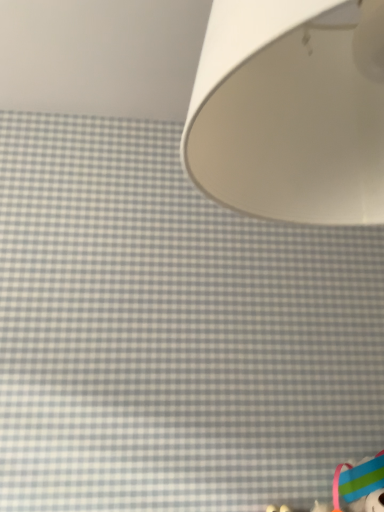
Locate an element on the screen. white matte lampshade at upper right is located at coordinates (291, 110).

What do you see at coordinates (291, 110) in the screenshot? I see `white matte lampshade at upper right` at bounding box center [291, 110].

The width and height of the screenshot is (384, 512). What do you see at coordinates (357, 487) in the screenshot?
I see `rubberized plastic toy at lower right` at bounding box center [357, 487].

In order to face rubberized plastic toy at lower right, should I rotate leftwards or rightwards?

Rotate your view right by about 22.534°.

Image resolution: width=384 pixels, height=512 pixels. In order to click on rubberized plastic toy at lower right in this screenshot , I will do `click(357, 487)`.

Locate an element on the screen. This screenshot has height=512, width=384. white matte lampshade at upper right is located at coordinates (291, 110).

Between white matte lampshade at upper right and rubberized plastic toy at lower right, which one appears on the left side from the viewer's perspective?

Positioned to the left is white matte lampshade at upper right.

From the picture: Which is in front, white matte lampshade at upper right or rubberized plastic toy at lower right?

white matte lampshade at upper right is closer to the camera.

Is point (269, 64) farther from camera compared to point (359, 500)?

No, it is not.

From the image's perspective, is white matte lampshade at upper right located above or below rubberized plastic toy at lower right?

From the image's perspective, white matte lampshade at upper right appears above rubberized plastic toy at lower right.

Looking at this image, from a real-world perspective, is white matte lampshade at upper right positioned over rubberized plastic toy at lower right based on gravity?

Yes, from a real-world perspective, white matte lampshade at upper right is over rubberized plastic toy at lower right

In terms of width, does white matte lampshade at upper right look wider or thinner when compared to rubberized plastic toy at lower right?

Clearly, white matte lampshade at upper right has more width compared to rubberized plastic toy at lower right.

Who is shorter, white matte lampshade at upper right or rubberized plastic toy at lower right?

rubberized plastic toy at lower right is shorter.

Considering the sizes of objects white matte lampshade at upper right and rubberized plastic toy at lower right in the image provided, who is bigger, white matte lampshade at upper right or rubberized plastic toy at lower right?

white matte lampshade at upper right is bigger.

Is white matte lampshade at upper right completely or partially outside of rubberized plastic toy at lower right?

white matte lampshade at upper right lies outside rubberized plastic toy at lower right's area.

Is white matte lampshade at upper right with rubberized plastic toy at lower right?

white matte lampshade at upper right and rubberized plastic toy at lower right are not in contact.

From the picture: Is rubberized plastic toy at lower right at the back of white matte lampshade at upper right?

No, rubberized plastic toy at lower right is not at the back of white matte lampshade at upper right.

Can you tell me how much white matte lampshade at upper right and rubberized plastic toy at lower right differ in facing direction?

white matte lampshade at upper right and rubberized plastic toy at lower right are facing 90.7 degrees away from each other.

How distant is white matte lampshade at upper right from rubberized plastic toy at lower right?

white matte lampshade at upper right and rubberized plastic toy at lower right are 3.37 feet apart.

Find the location of a particular element. This screenshot has height=512, width=384. toy located on the right of white matte lampshade at upper right is located at coordinates (357, 487).

Which is more to the right, rubberized plastic toy at lower right or white matte lampshade at upper right?

From the viewer's perspective, rubberized plastic toy at lower right appears more on the right side.

Which object is closer to the camera, rubberized plastic toy at lower right or white matte lampshade at upper right?

white matte lampshade at upper right is closer to the camera.

Which point is more distant from viewer, (368, 485) or (312, 96)?

The point (368, 485) is farther.

From the image's perspective, which one is positioned lower, rubberized plastic toy at lower right or white matte lampshade at upper right?

rubberized plastic toy at lower right is shown below in the image.

From a real-world perspective, which object stands above the other?

white matte lampshade at upper right, from a real-world perspective.

In terms of width, does rubberized plastic toy at lower right look wider or thinner when compared to white matte lampshade at upper right?

rubberized plastic toy at lower right is thinner than white matte lampshade at upper right.

Does rubberized plastic toy at lower right have a greater height compared to white matte lampshade at upper right?

No.

In terms of size, does rubberized plastic toy at lower right appear bigger or smaller than white matte lampshade at upper right?

rubberized plastic toy at lower right is smaller than white matte lampshade at upper right.

Would you say rubberized plastic toy at lower right contains white matte lampshade at upper right?

No, white matte lampshade at upper right is not surrounded by rubberized plastic toy at lower right.

Is rubberized plastic toy at lower right touching white matte lampshade at upper right?

No.

Is rubberized plastic toy at lower right turned away from white matte lampshade at upper right?

rubberized plastic toy at lower right does not have its back to white matte lampshade at upper right.

The width and height of the screenshot is (384, 512). Find the location of `toy on the right side of white matte lampshade at upper right`. toy on the right side of white matte lampshade at upper right is located at coordinates (357, 487).

The width and height of the screenshot is (384, 512). In order to click on lamp above the rubberized plastic toy at lower right (from the image's perspective) in this screenshot , I will do `click(291, 110)`.

Locate an element on the screen. toy that is behind the white matte lampshade at upper right is located at coordinates (357, 487).